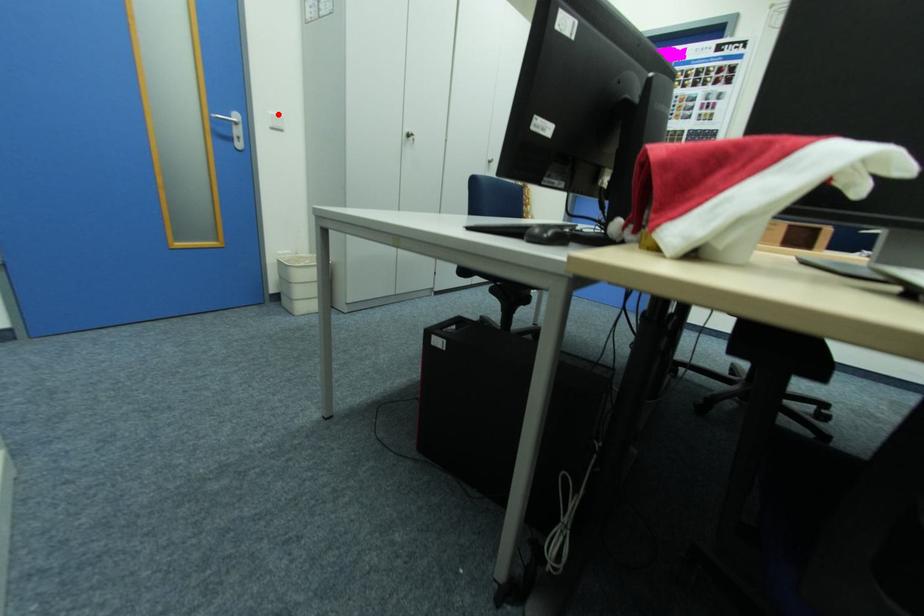
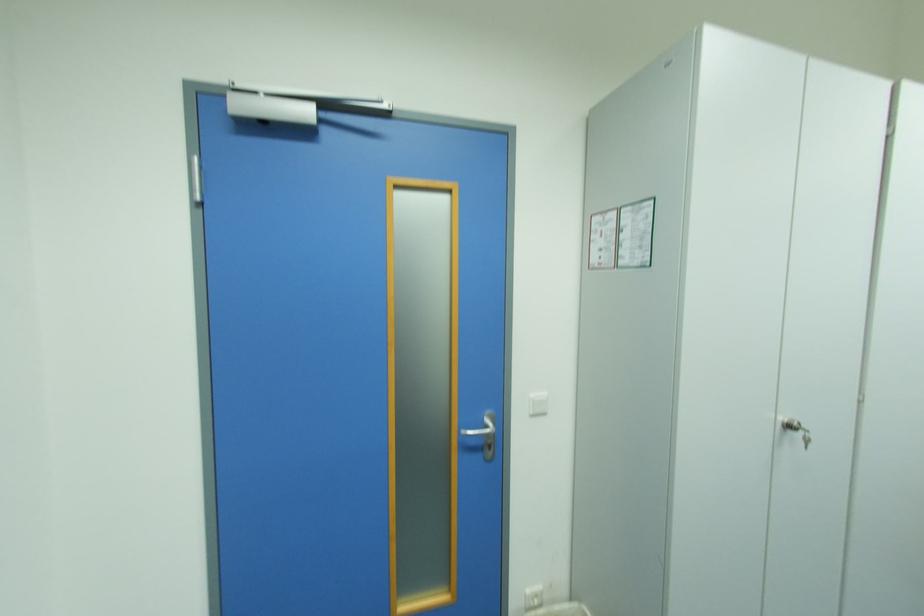
Question: I am providing you with two images of the same scene from different viewpoints. A red point is marked on the first image. Can you still see the location of the red point in image 2?

Choices:
 (A) Yes
 (B) No

Answer: (A)